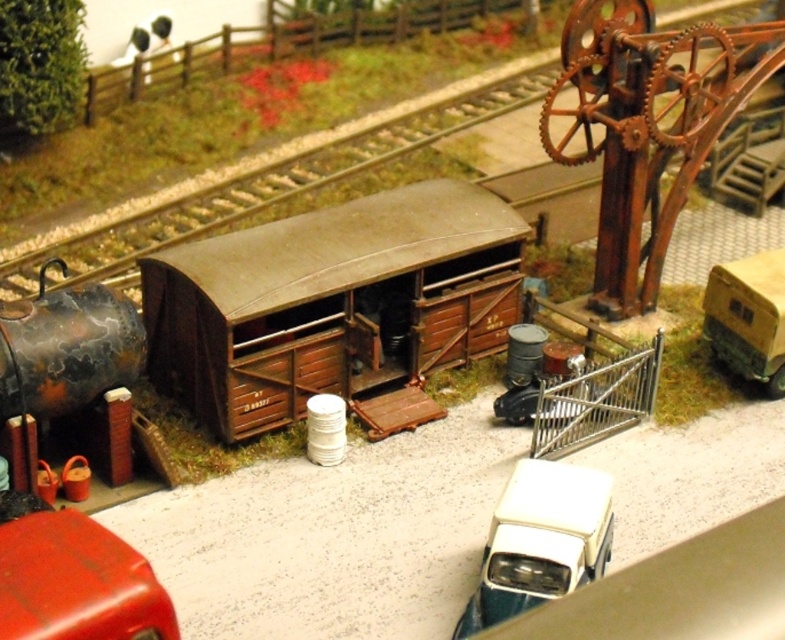
You are a model railway enthusiast examining the diorama. You notice a point marked at coordinates (330, 301). What object is located at this point?

The point at coordinates (330, 301) corresponds to the brown wooden train car at center.

You are a model railway enthusiast examining the diorama. You notice the brown wooden train car at center and the matte yellow trailer at right. Based on their positions, which one is closer to the left side of the scene?

The brown wooden train car at center is to the left of the matte yellow trailer at right, so it is closer to the left side of the scene.

You are a model railway enthusiast examining the diorama. You need to place a new miniature figure near the brown wooden train car at center. What are the coordinates where you should position it?

The coordinates for the brown wooden train car at center are point (x=330, y=301), so you should position the new miniature figure near those coordinates.